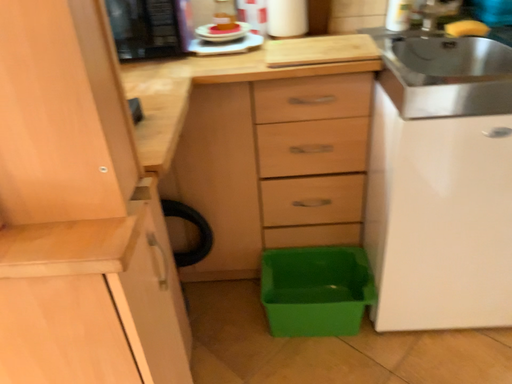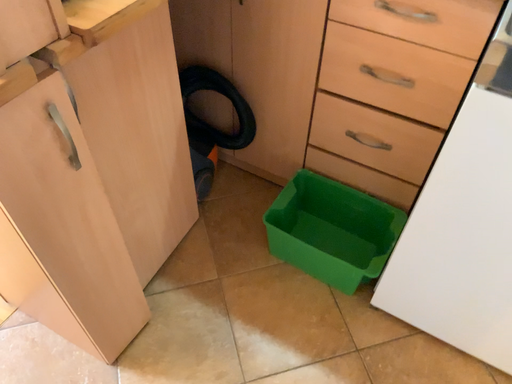
Question: How did the camera likely rotate when shooting the video?

Choices:
 (A) rotated downward
 (B) rotated upward

Answer: (A)